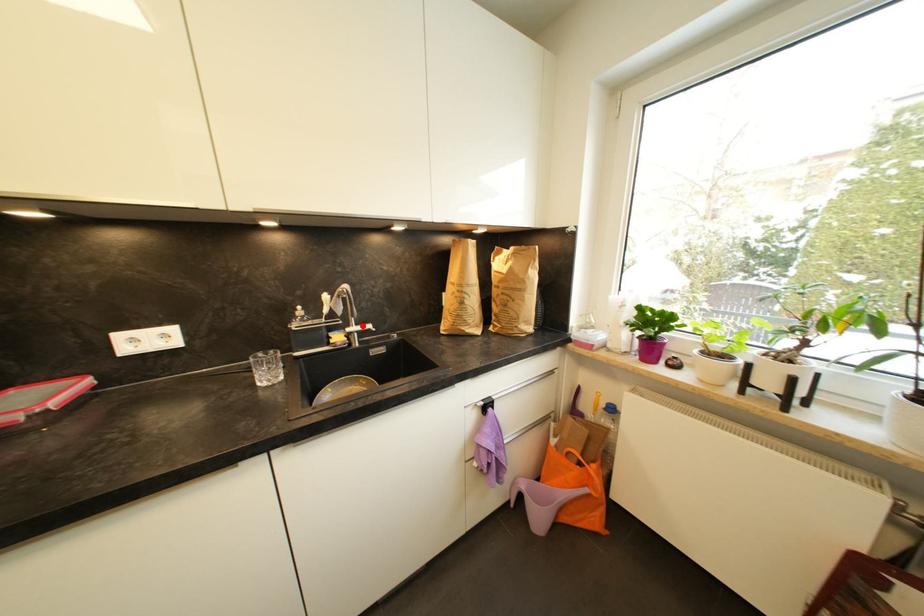
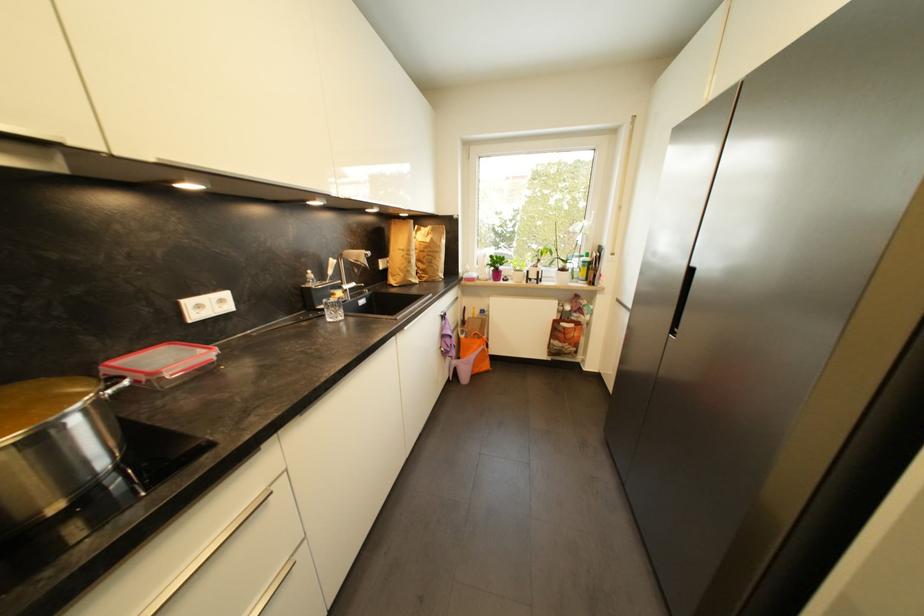
Question: A red point is marked in image1. In image2, is the corresponding 3D point closer to the camera or farther? Reply with the corresponding letter.

Choices:
 (A) The corresponding 3D point is closer.
 (B) The corresponding 3D point is farther.

Answer: (A)